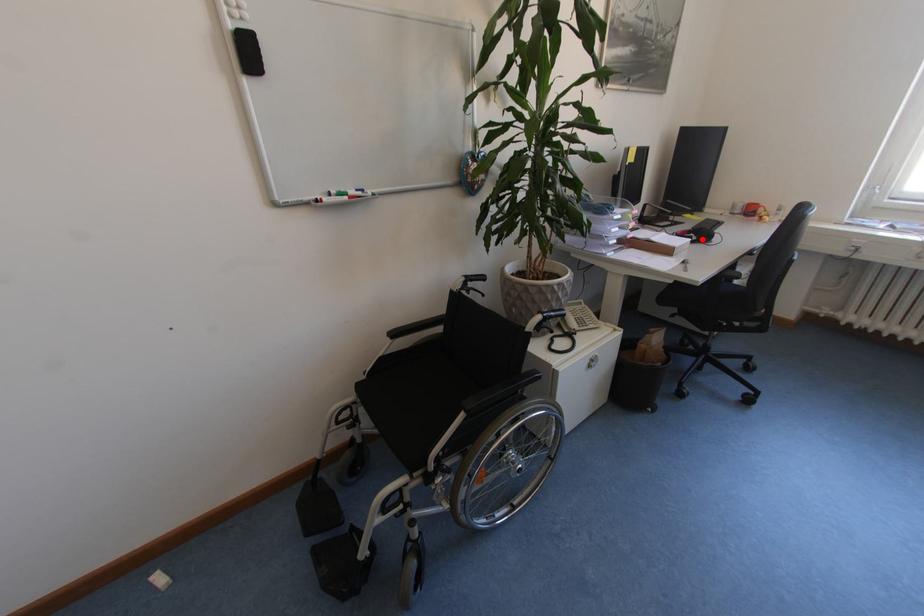
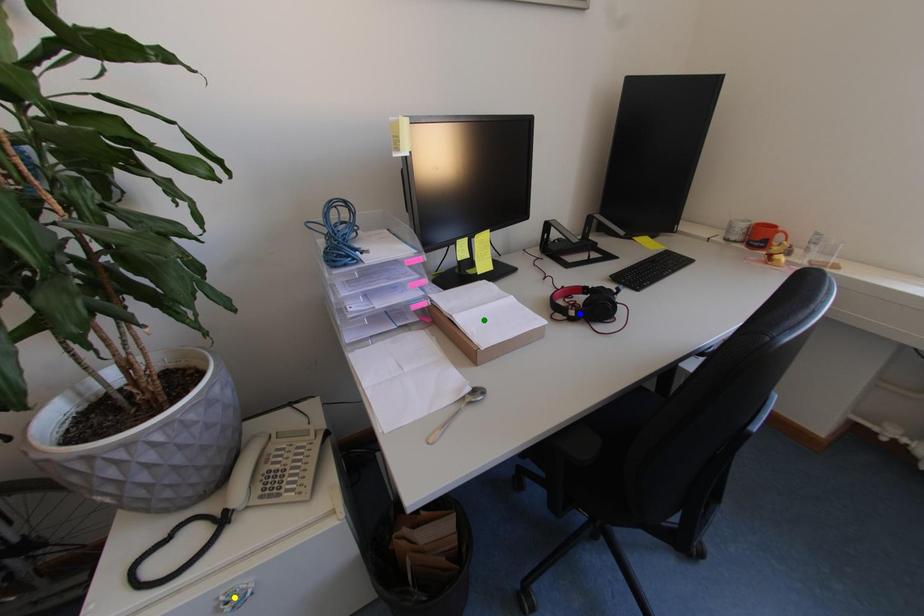
Question: I am providing you with two images of the same scene from different viewpoints. A red point is marked on the first image. You are given multiple points on the second image. Which point in image 2 is actually the same real-world point as the red point in image 1?

Choices:
 (A) yellow point
 (B) green point
 (C) blue point

Answer: (C)